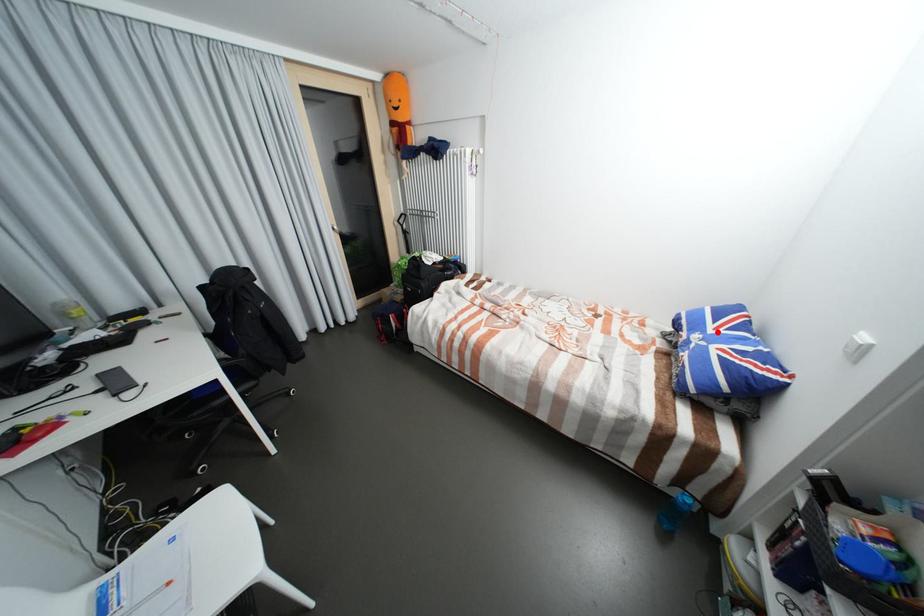
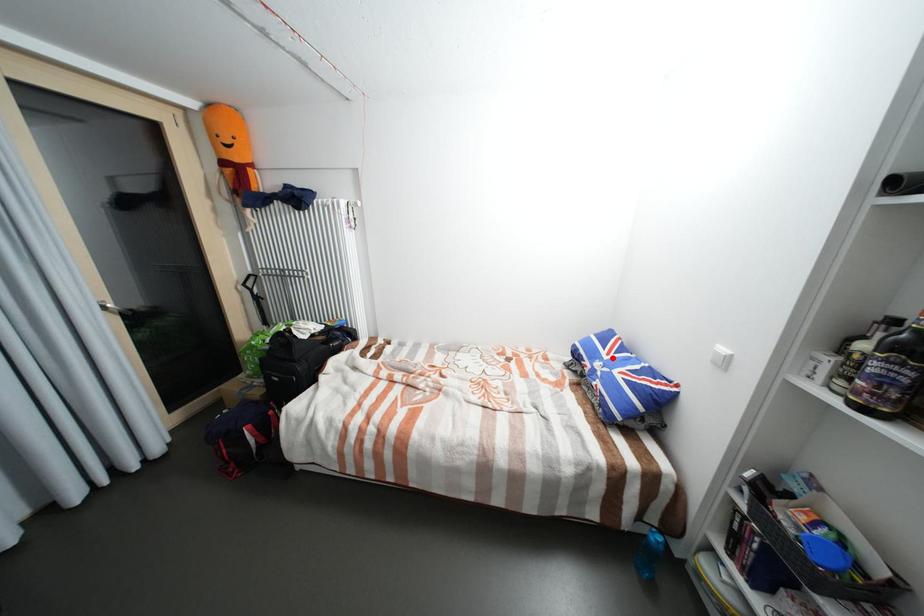
I am providing you with two images of the same scene from different viewpoints. A red point is marked on the first image and another point is marked on the second image. Is the marked point in image1 the same physical position as the marked point in image2?

Yes